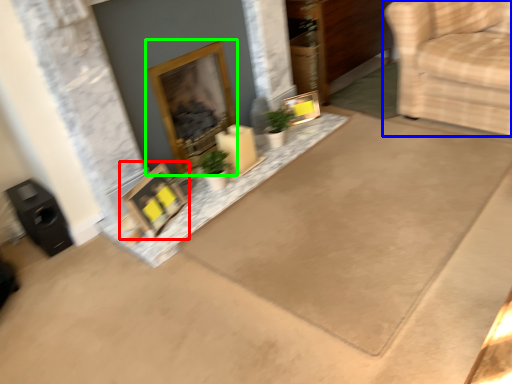
Question: Which object is the farthest from picture frame (highlighted by a red box)? Choose among these: furniture (highlighted by a blue box) or fireplace (highlighted by a green box).

Choices:
 (A) furniture
 (B) fireplace

Answer: (A)